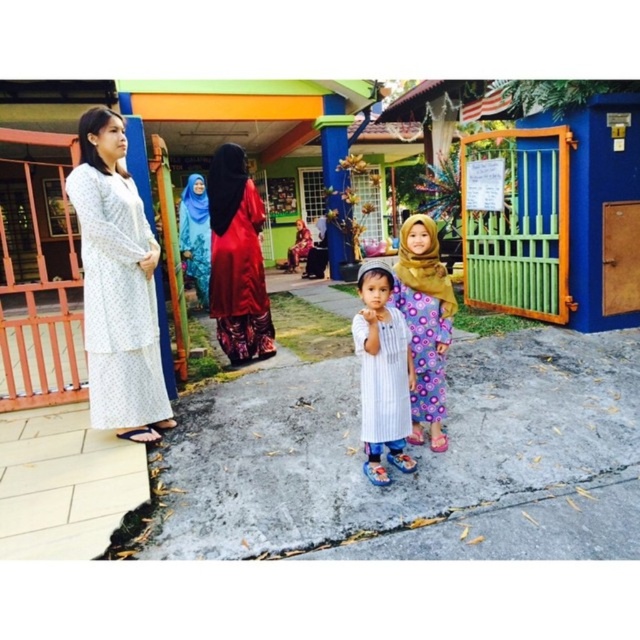
Can you confirm if white printed dress at left is thinner than striped fabric dress at center?

No.

Based on the photo, does white printed dress at left have a greater width compared to striped fabric dress at center?

Correct, the width of white printed dress at left exceeds that of striped fabric dress at center.

Who is more distant from viewer, [109,408] or [444,305]?

Positioned behind is point [109,408].

This screenshot has height=640, width=640. Identify the location of white printed dress at left. (116, 285).

This screenshot has width=640, height=640. What do you see at coordinates (412, 452) in the screenshot?
I see `gray concrete pavement at center` at bounding box center [412, 452].

In the scene shown: Does gray concrete pavement at center have a larger size compared to white printed dress at left?

Yes, gray concrete pavement at center is bigger than white printed dress at left.

Does point (312, 394) lie behind point (115, 218)?

Yes.

Where is `gray concrete pavement at center`? gray concrete pavement at center is located at coordinates [x=412, y=452].

Can you confirm if striped fabric dress at center is wider than blue fabric hijab at center?

No.

You are a GUI agent. You are given a task and a screenshot of the screen. Output one action in this format:
    pyautogui.click(x=<x>, y=<y>)
    Task: Click on the striped fabric dress at center
    This screenshot has width=640, height=640.
    Given the screenshot: What is the action you would take?
    pyautogui.click(x=424, y=323)

The image size is (640, 640). In order to click on striped fabric dress at center in this screenshot , I will do (424, 323).